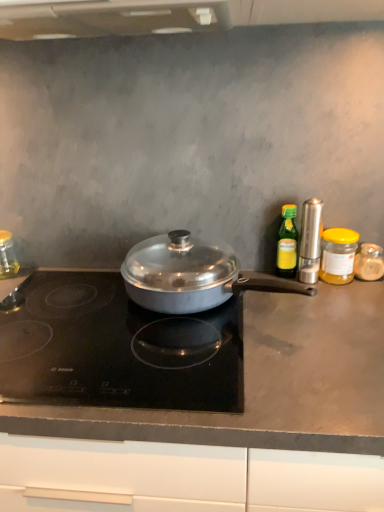
At what (x,y) coordinates should I click in order to perform the action: click on vacant space in front of clear glass jar at left, the sixth kitchen appliance in the right-to-left sequence. Please return your answer as a coordinate pair (x, y). The height and width of the screenshot is (512, 384). Looking at the image, I should click on (16, 294).